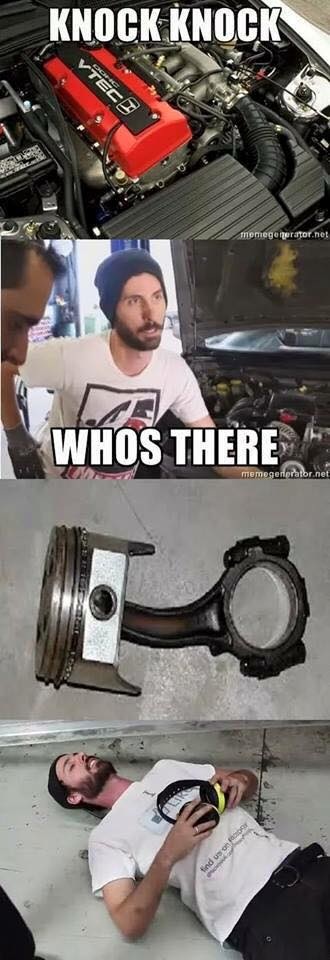
Identify the location of concrete floor. The width and height of the screenshot is (330, 960). (39, 814).